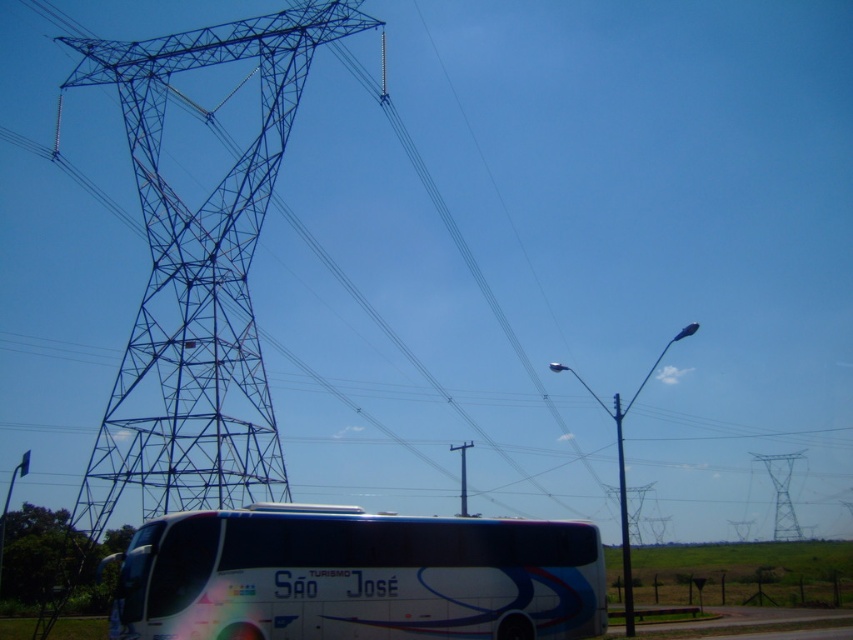
You are standing at the point labeled point (194, 285). What structure are you touching?

The point labeled point (194, 285) is on the metallic blue tower at left, so you are touching the metallic blue tower at left.

You are a photographer planning to capture the metallic blue tower at left and the white glossy bus at lower center in a single frame. Based on their sizes, which object should you focus on first to ensure both are clearly visible in the photo?

The metallic blue tower at left is thinner than the white glossy bus at lower center, so you should focus on the white glossy bus at lower center first since it is larger and will require more attention to detail to capture clearly.

You are a photographer positioned at the scene. You want to take a photo that includes both the metallic blue tower at left and the white glossy bus at lower center. However, you have a limited field of view. Based on their positions, which object should you focus on first to ensure both are in the frame?

The metallic blue tower at left is further to the viewer than the white glossy bus at lower center. To include both in the frame, focus on the metallic blue tower at left first, then adjust to include the white glossy bus at lower center.